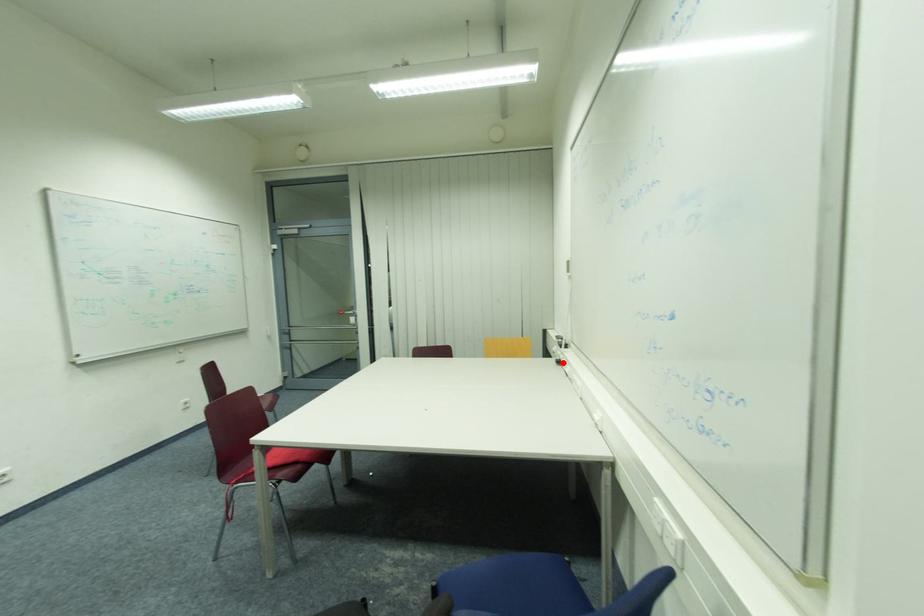
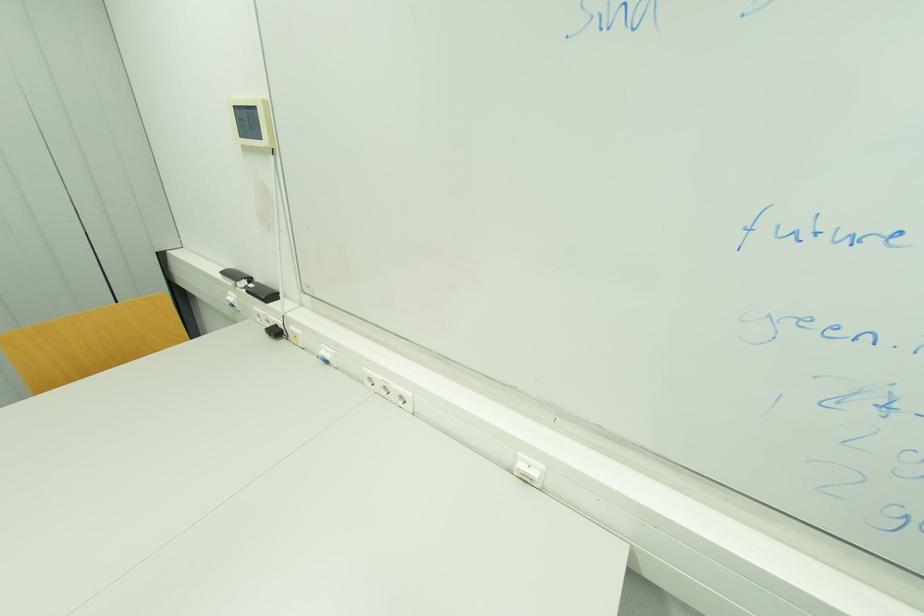
The point at the highlighted location is marked in the first image. Where is the corresponding point in the second image?

(281, 333)